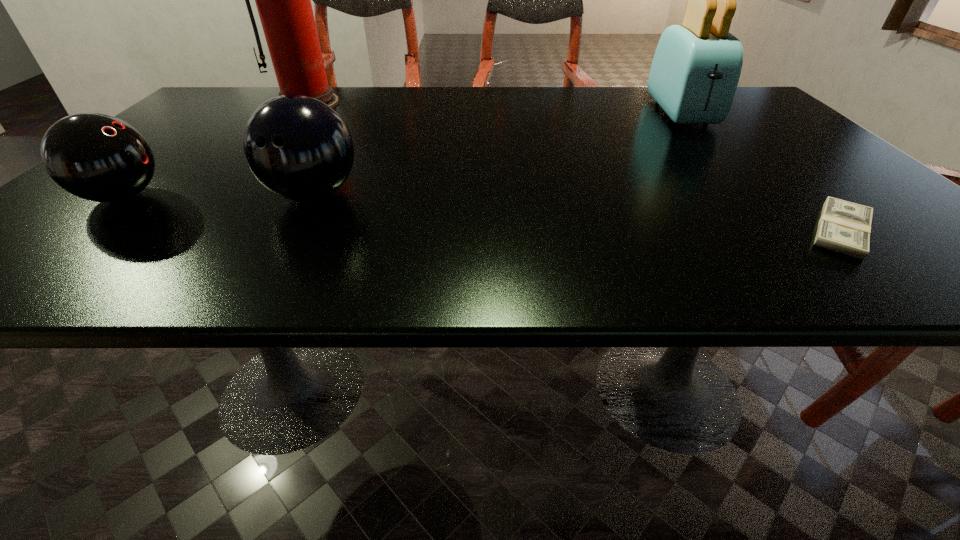
I want to click on vacant area in the image that satisfies the following two spatial constraints: 1. at the discharge end of the tallest object; 2. on the surface of the shorter bowling ball near the finger holes, so click(231, 197).

The height and width of the screenshot is (540, 960). Find the location of `vacant region that satisfies the following two spatial constraints: 1. on the surface of the fourth tallest object near the finger holes; 2. on the back side of the dollar`. vacant region that satisfies the following two spatial constraints: 1. on the surface of the fourth tallest object near the finger holes; 2. on the back side of the dollar is located at coordinates (84, 230).

Where is `free location that satisfies the following two spatial constraints: 1. on the surface of the shortest object near the finger holes; 2. on the right side of the left bowling ball`? The image size is (960, 540). free location that satisfies the following two spatial constraints: 1. on the surface of the shortest object near the finger holes; 2. on the right side of the left bowling ball is located at coordinates (84, 230).

I want to click on blank space that satisfies the following two spatial constraints: 1. on the side of the shortest object with the finger holes; 2. on the right side of the right bowling ball, so click(x=294, y=230).

At what (x,y) coordinates should I click in order to perform the action: click on vacant area that satisfies the following two spatial constraints: 1. on the surface of the second shortest object near the finger holes; 2. on the left side of the shortest object. Please return your answer as a coordinate pair (x, y). This screenshot has height=540, width=960. Looking at the image, I should click on (84, 230).

Locate an element on the screen. This screenshot has height=540, width=960. blank space that satisfies the following two spatial constraints: 1. on the side of the toaster with the lever; 2. on the left side of the shortest object is located at coordinates (790, 230).

The width and height of the screenshot is (960, 540). Identify the location of free spot that satisfies the following two spatial constraints: 1. on the side of the right bowling ball with the finger holes; 2. on the surface of the shorter bowling ball near the finger holes. (312, 197).